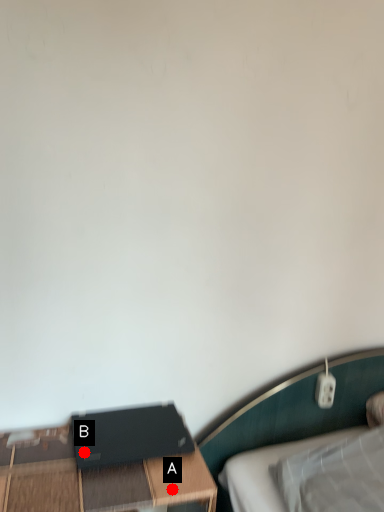
Question: Two points are circled on the image, labeled by A and B beside each circle. Which point is further to the camera?

Choices:
 (A) A is further
 (B) B is further

Answer: (B)